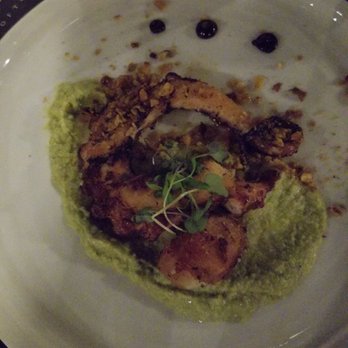
Find the location of a particular element. The height and width of the screenshot is (348, 348). plate is located at coordinates (42, 39).